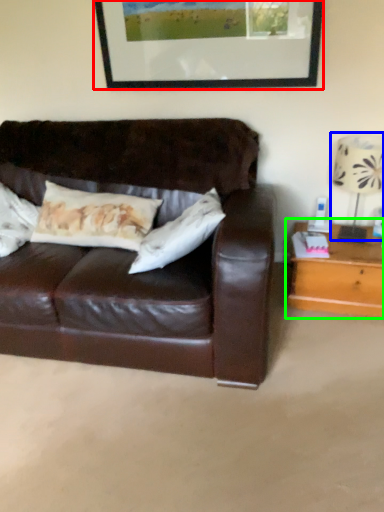
Question: Considering the real-world distances, which object is farthest from picture frame (highlighted by a red box)? table lamp (highlighted by a blue box) or table (highlighted by a green box)?

Choices:
 (A) table lamp
 (B) table

Answer: (B)